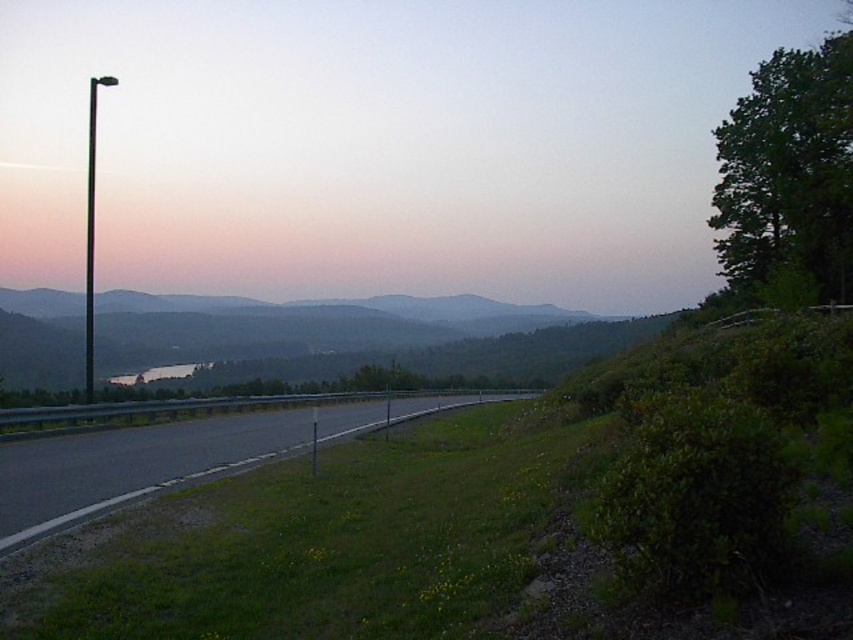
You are driving a car that is 2 meters wide. You want to park your car on the asphalt road at center. Is there enough space between the matte black pole at left and the guardrail on the right side of the road?

The matte black pole at left is further to the viewer than asphalt road at center, but the description does not provide information about the width of the asphalt road at center or the distance between the pole and the guardrail. Therefore, it is impossible to determine if there is enough space for the car to park.

Looking at this image, you are a painter setting up an easel to capture the scene. You want to ensure the matte black pole at left and asphalt road at center are both visible in your painting. Considering their sizes, which object should you position closer to the center of your canvas to maintain balance?

The matte black pole at left is larger in size than the asphalt road at center, so to maintain balance in the painting, position the smaller asphalt road at center closer to the center of the canvas while placing the larger matte black pole at left slightly off to the side.

You are a photographer positioned at the camera location aiming to capture the matte black pole at left in your shot. Considering the distance, can you estimate how far you are from the pole?

The distance between the matte black pole at left and the camera is 114.76 meters, so you are approximately 114.76 meters away from the pole.